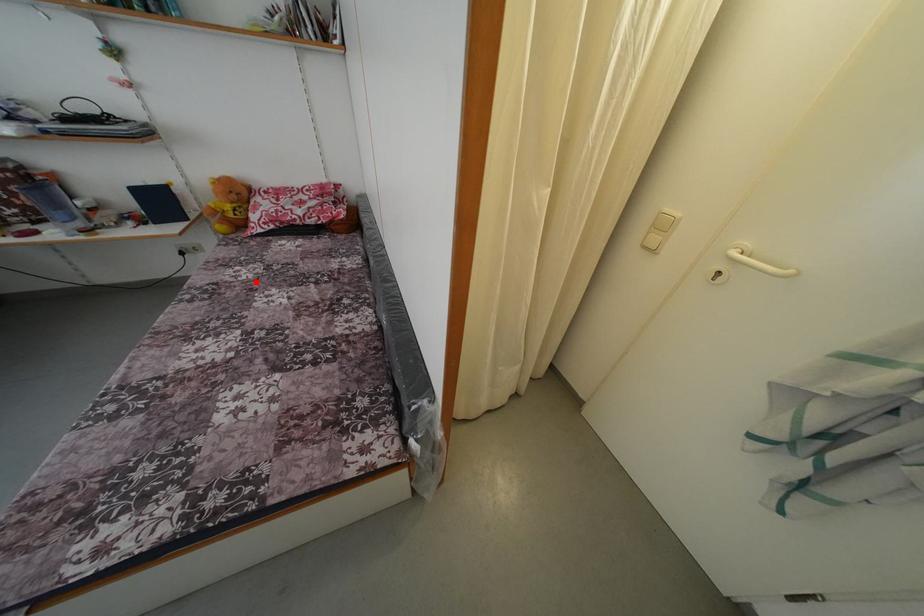
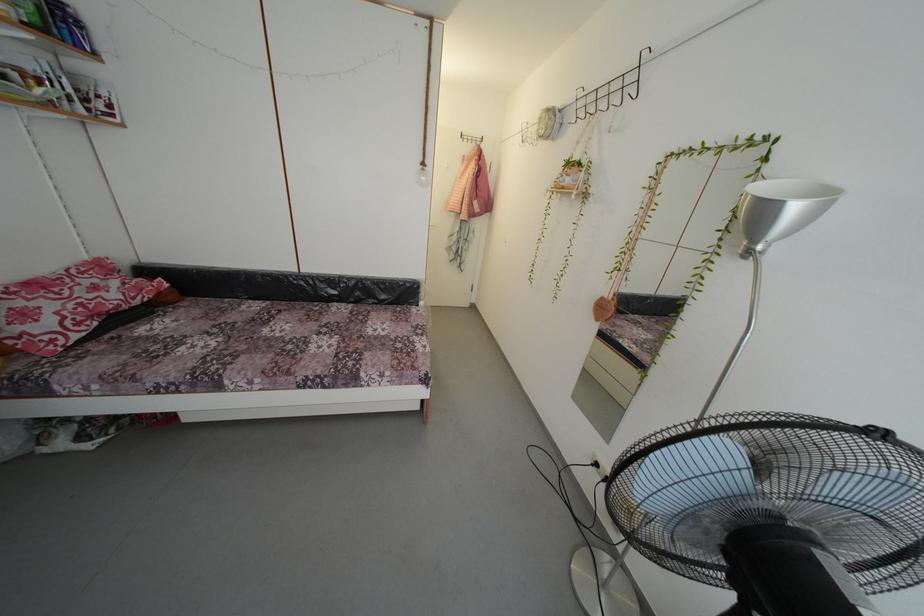
Where in the second image is the point corresponding to the highlighted location from the first image?

(225, 345)